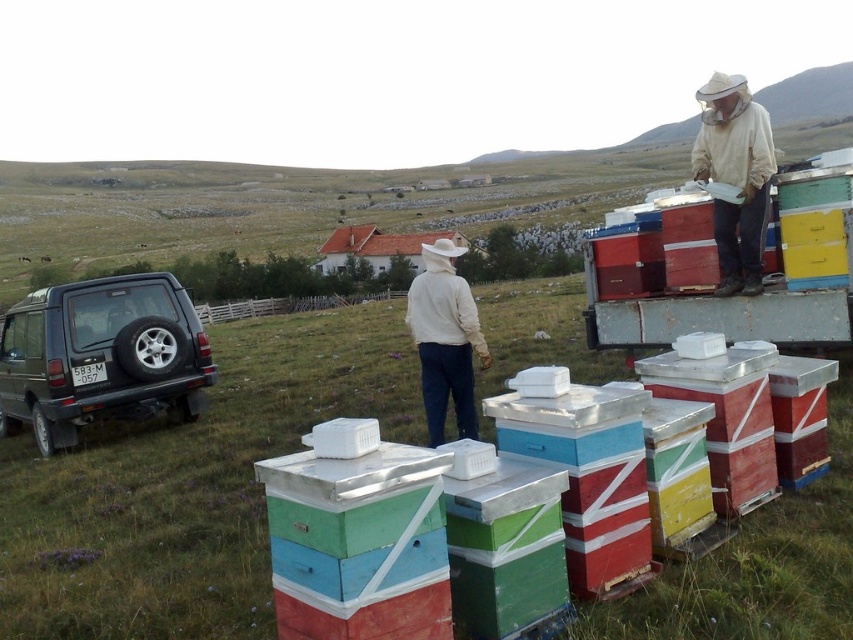
Question: Does dark gray matte suv at lower left lie behind white mesh hat at upper right?

Choices:
 (A) yes
 (B) no

Answer: (A)

Question: Which point is closer to the camera?

Choices:
 (A) (438, 408)
 (B) (735, 180)
 (C) (129, 349)

Answer: (A)

Question: In this image, where is white mesh hat at upper right located relative to white matte jacket at center?

Choices:
 (A) above
 (B) below

Answer: (A)

Question: Which point appears farthest from the camera in this image?

Choices:
 (A) (79, 369)
 (B) (427, 392)

Answer: (A)

Question: Which point is farther from the camera taking this photo?

Choices:
 (A) (457, 436)
 (B) (728, 106)

Answer: (A)

Question: Where is dark gray matte suv at lower left located in relation to white mesh hat at upper right in the image?

Choices:
 (A) below
 (B) above

Answer: (A)